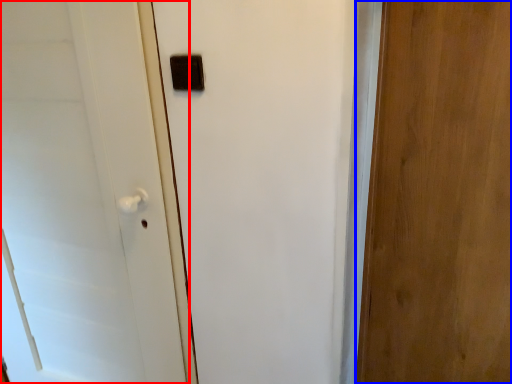
Question: Which of the following is the closest to the observer, door (highlighted by a red box) or door (highlighted by a blue box)?

Choices:
 (A) door
 (B) door

Answer: (B)